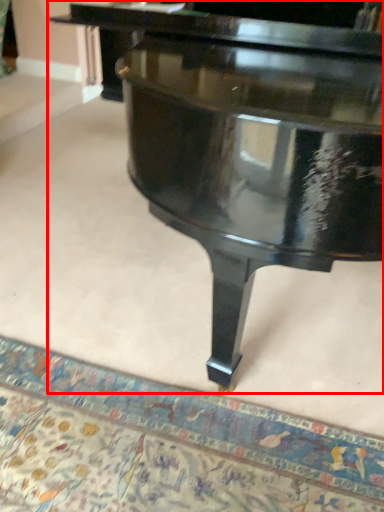
Question: From the image's perspective, considering the relative positions of piano (annotated by the red box) and mat in the image provided, where is piano (annotated by the red box) located with respect to the staircase?

Choices:
 (A) below
 (B) above

Answer: (B)